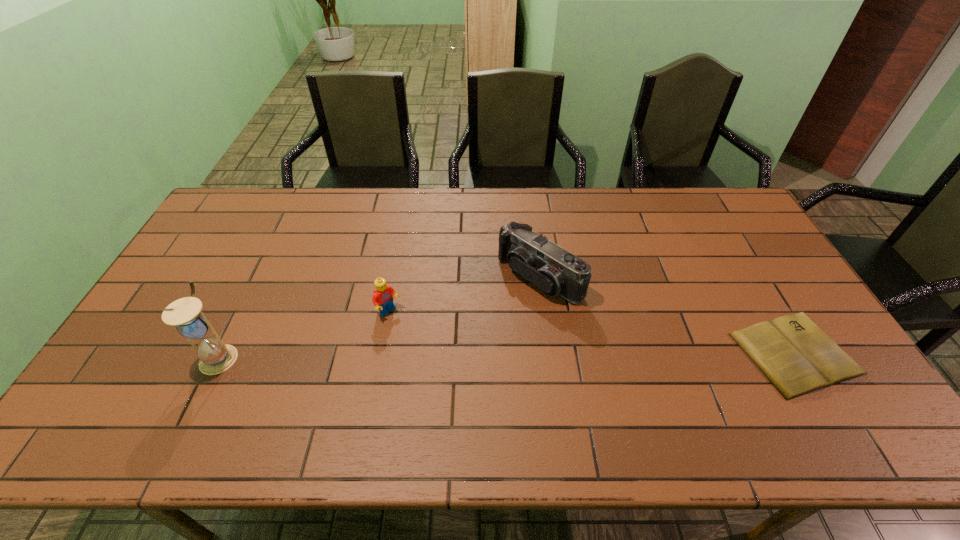
I want to click on the leftmost object, so click(x=215, y=357).

Where is `hourglass`? Image resolution: width=960 pixels, height=540 pixels. hourglass is located at coordinates (215, 357).

Image resolution: width=960 pixels, height=540 pixels. I want to click on the rightmost object, so pos(795,355).

This screenshot has width=960, height=540. Identify the location of book. (795, 355).

Locate an element on the screen. Lego is located at coordinates (383, 294).

Where is `the second shortest object`? The height and width of the screenshot is (540, 960). the second shortest object is located at coordinates (383, 294).

Image resolution: width=960 pixels, height=540 pixels. I want to click on camcorder, so click(555, 271).

This screenshot has width=960, height=540. Find the location of `vacant space located 0.070m on the back of the leftmost object`. vacant space located 0.070m on the back of the leftmost object is located at coordinates (238, 319).

The width and height of the screenshot is (960, 540). What are the coordinates of `vacant space located on the left of the rightmost object` in the screenshot? It's located at (612, 353).

Locate an element on the screen. This screenshot has width=960, height=540. free space located on the face of the second object from left to right is located at coordinates (469, 383).